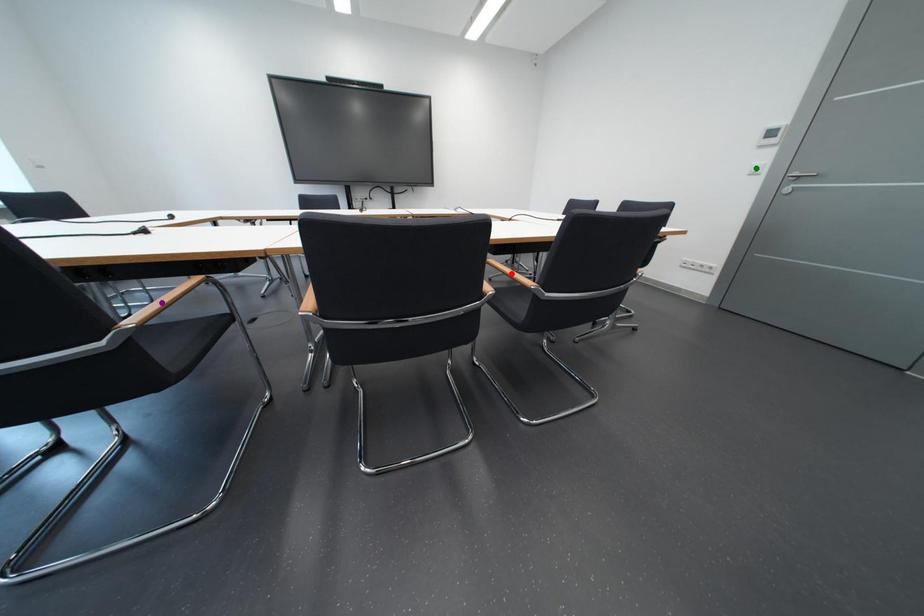
From the picture: Order these from nearest to farthest:
1. red point
2. purple point
3. green point

red point → green point → purple point